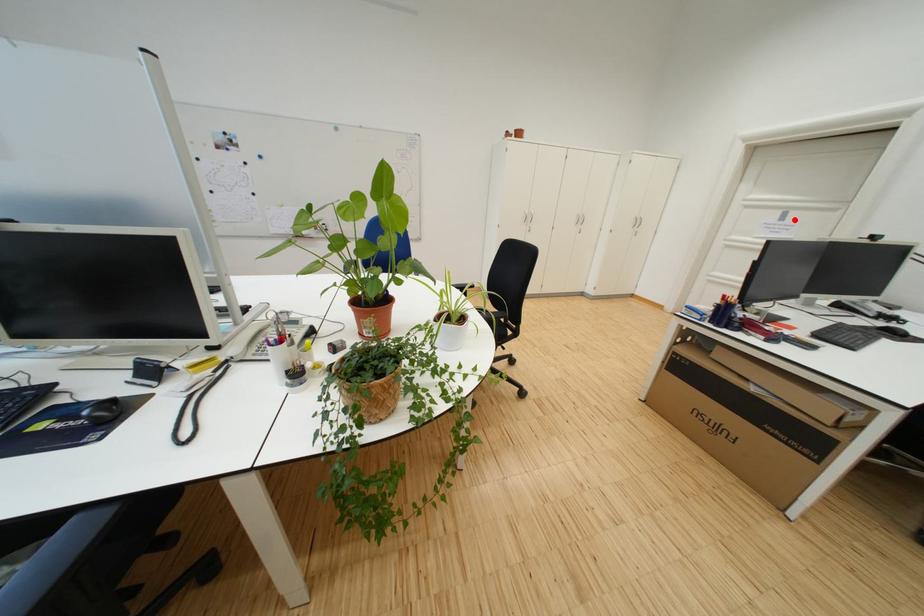
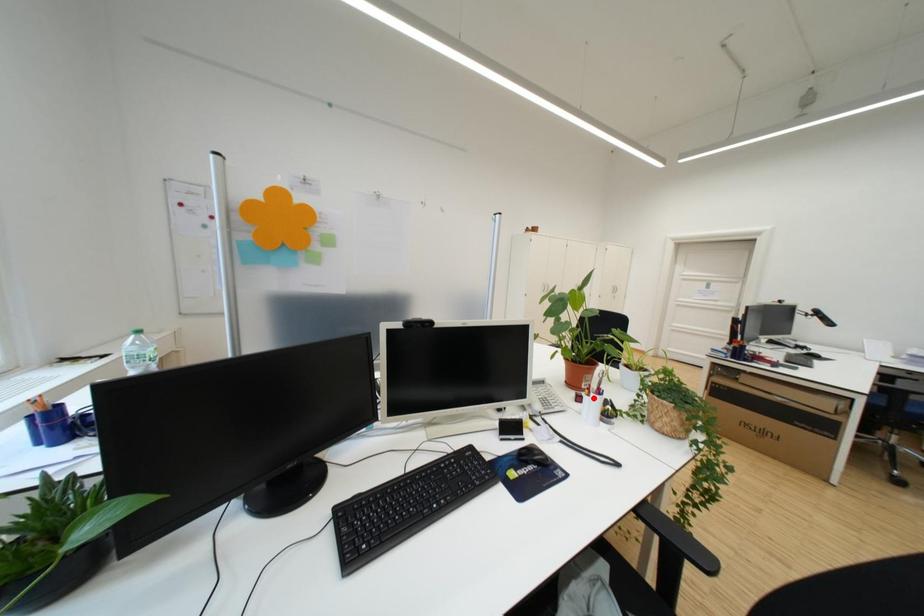
I am providing you with two images of the same scene from different viewpoints. A red point is marked on the first image and another point is marked on the second image. Is the marked point in image1 the same physical position as the marked point in image2?

No